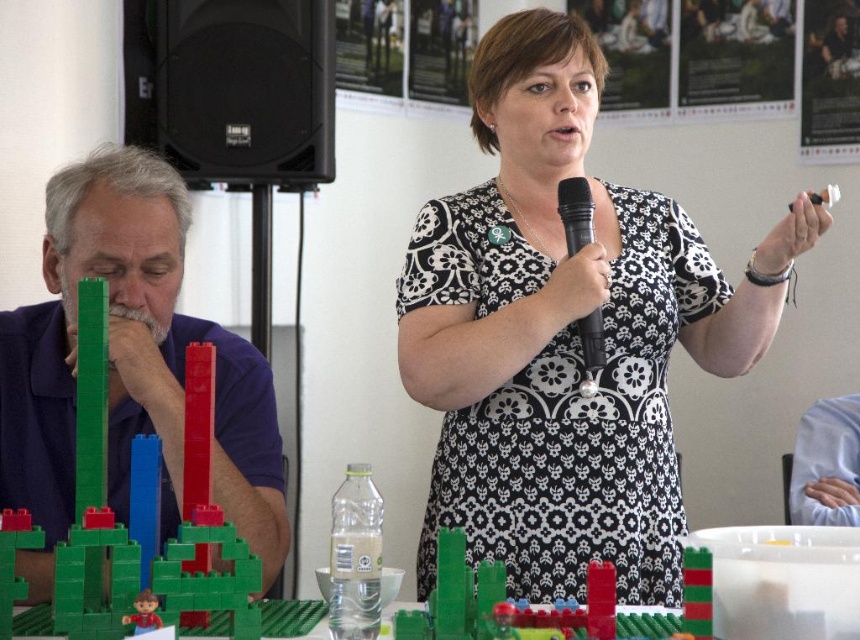
Can you confirm if black printed dress at center is bigger than purple matte shirt at left?

Yes, black printed dress at center is bigger than purple matte shirt at left.

What do you see at coordinates (564, 333) in the screenshot? I see `black printed dress at center` at bounding box center [564, 333].

At what (x,y) coordinates should I click in order to perform the action: click on black printed dress at center. Please return your answer as a coordinate pair (x, y). Looking at the image, I should click on (564, 333).

Locate an element on the screen. The image size is (860, 640). black matte speaker at upper left is located at coordinates point(232,88).

Is point (292, 144) farther from camera compared to point (602, 356)?

Yes.

Locate an element on the screen. The height and width of the screenshot is (640, 860). black matte speaker at upper left is located at coordinates (232, 88).

Between purple matte shirt at left and black matte speaker at upper left, which one is positioned lower?

purple matte shirt at left is below.

Is purple matte shirt at left above black matte speaker at upper left?

No.

Locate an element on the screen. This screenshot has width=860, height=640. purple matte shirt at left is located at coordinates (129, 365).